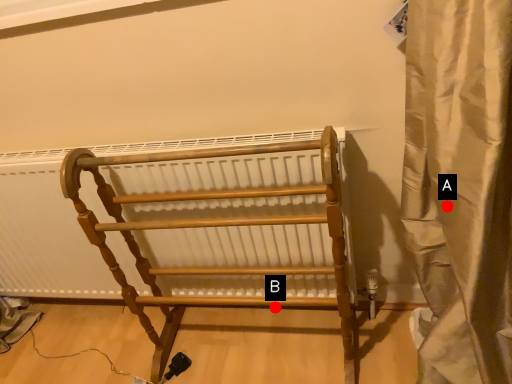
Question: Two points are circled on the image, labeled by A and B beside each circle. Which point is closer to the camera taking this photo?

Choices:
 (A) A is closer
 (B) B is closer

Answer: (A)